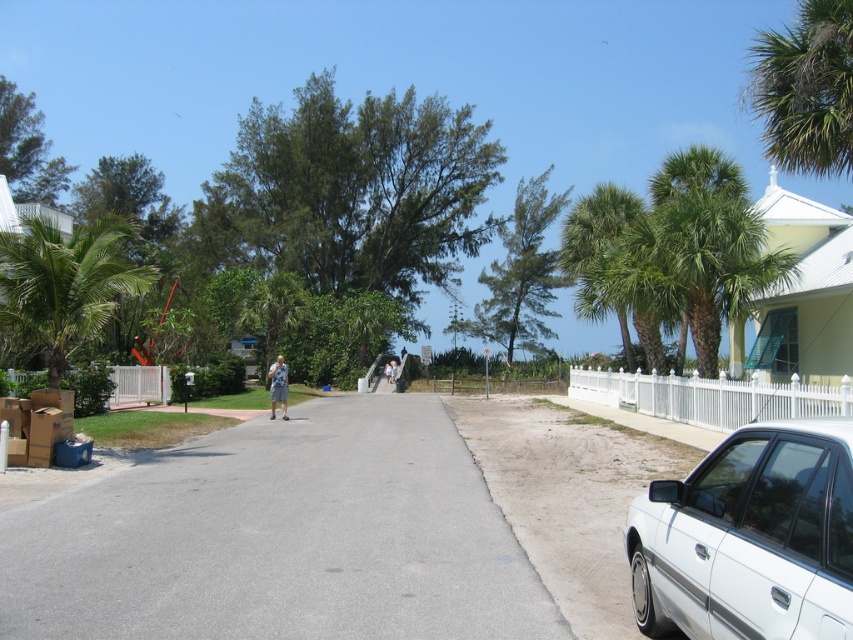
Question: Can you confirm if green leafy palm tree at upper right is wider than green leafy palm tree at left?

Choices:
 (A) no
 (B) yes

Answer: (B)

Question: Which object appears farthest from the camera in this image?

Choices:
 (A) green leafy palm tree at right
 (B) green leafy palm tree at left
 (C) white matte sedan at lower right
 (D) green leafy palm tree at upper right

Answer: (A)

Question: Can you confirm if white matte sedan at lower right is positioned to the left of green leafy palm tree at right?

Choices:
 (A) no
 (B) yes

Answer: (B)

Question: Estimate the real-world distances between objects in this image. Which object is farther from the green leafy palm tree at right?

Choices:
 (A) green leafy palm tree at left
 (B) light blue denim shorts at center

Answer: (A)

Question: Among these points, which one is nearest to the camera?

Choices:
 (A) (282, 406)
 (B) (705, 560)

Answer: (B)

Question: Can you confirm if white matte sedan at lower right is positioned to the left of green leafy palm tree at right?

Choices:
 (A) no
 (B) yes

Answer: (B)